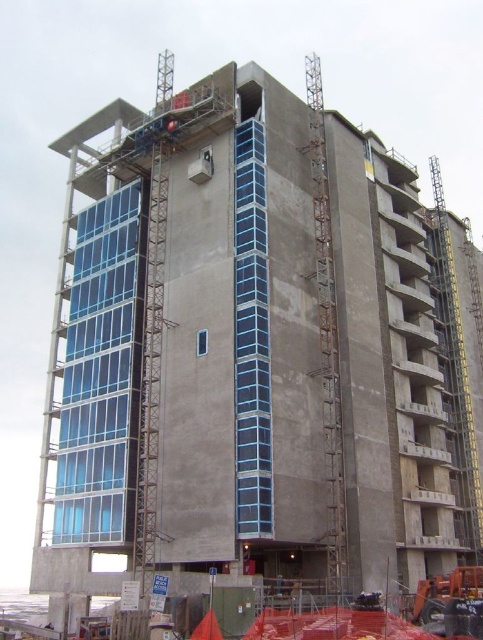
Question: Among these points, which one is nearest to the camera?

Choices:
 (A) (210, 612)
 (B) (332, 384)

Answer: (A)

Question: Which point is farther to the camera?

Choices:
 (A) (267, 609)
 (B) (312, 67)

Answer: (B)

Question: Does rusty metal crane at right appear on the right side of concrete scaffolding at lower center?

Choices:
 (A) no
 (B) yes

Answer: (B)

Question: Is rusty metal crane at right smaller than concrete scaffolding at lower center?

Choices:
 (A) no
 (B) yes

Answer: (A)

Question: Does rusty metal crane at right come behind concrete scaffolding at lower center?

Choices:
 (A) yes
 (B) no

Answer: (A)